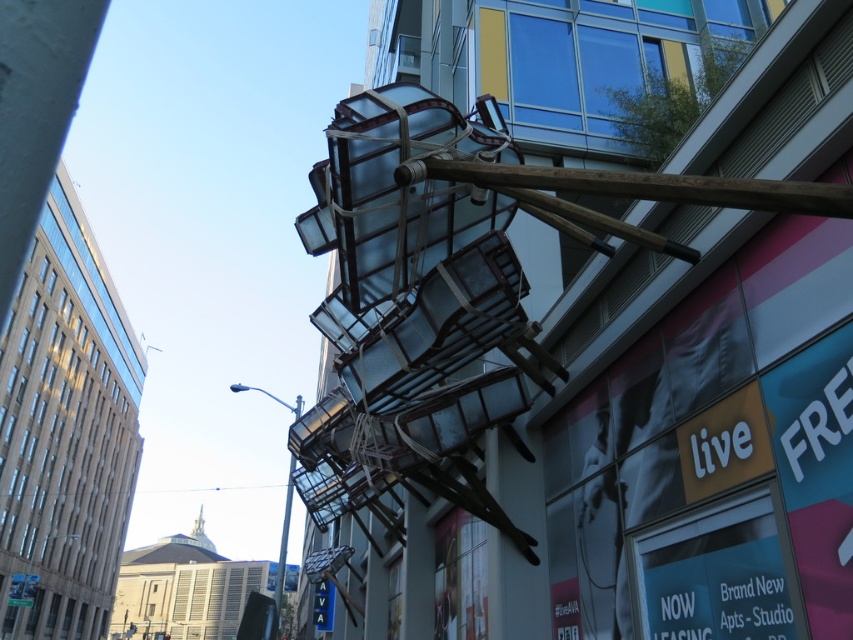
You are a delivery person trying to reach the rooftop of the building. There is a wooden pole at upper center. Can you use it to climb up?

The wooden pole at upper center is located at point (636, 184), which is on the upper part of the building. However, the description does not mention any ladders or footholds on the pole, so it might not be suitable for climbing to reach the rooftop.

Looking at this image, you are standing in front of the modern building and notice two points marked on the facade. The first point is at coordinates point [430,173] and the second at point [279,593]. Which point is closer to your current position?

Point [430,173] is closer to the camera than point [279,593], so the first point is closer to your current position.